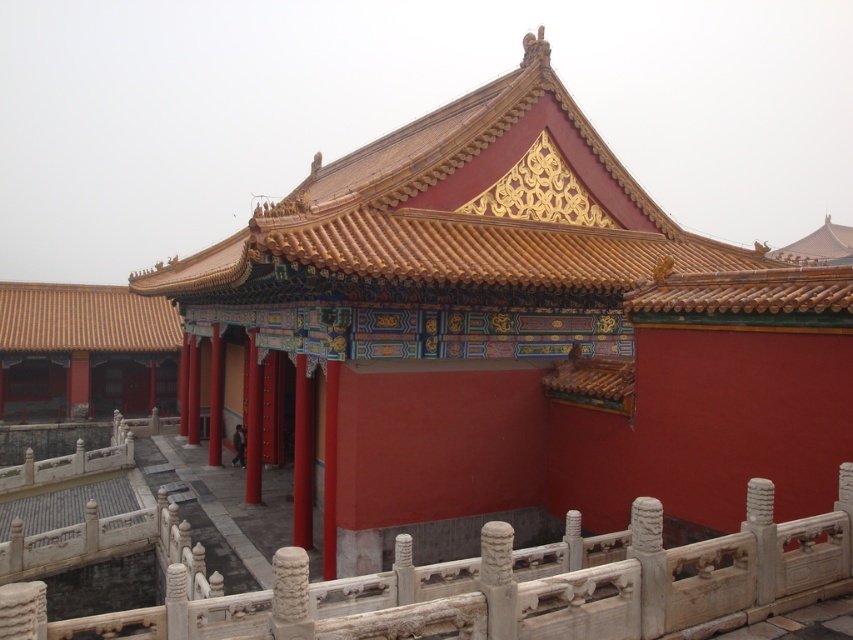
Is point (305, 205) closer to viewer compared to point (781, 564)?

No, (305, 205) is further to viewer.

Which is behind, point (469, 228) or point (712, 544)?

The point (469, 228) is more distant.

Where is `golden glazed tiles at upper center`? The height and width of the screenshot is (640, 853). golden glazed tiles at upper center is located at coordinates (463, 208).

Who is taller, white stone railing at lower center or brown tile roof at upper left?

With more height is white stone railing at lower center.

Describe the element at coordinates (503, 586) in the screenshot. I see `white stone railing at lower center` at that location.

Locate an element on the screen. white stone railing at lower center is located at coordinates (503, 586).

Is golden glazed tiles at upper center shorter than brown tile roof at upper left?

In fact, golden glazed tiles at upper center may be taller than brown tile roof at upper left.

Can you confirm if golden glazed tiles at upper center is positioned below brown tile roof at upper left?

No, golden glazed tiles at upper center is not below brown tile roof at upper left.

Is point (361, 172) farther from viewer compared to point (119, 301)?

No, it is in front of (119, 301).

Identify the location of golden glazed tiles at upper center. This screenshot has width=853, height=640. (463, 208).